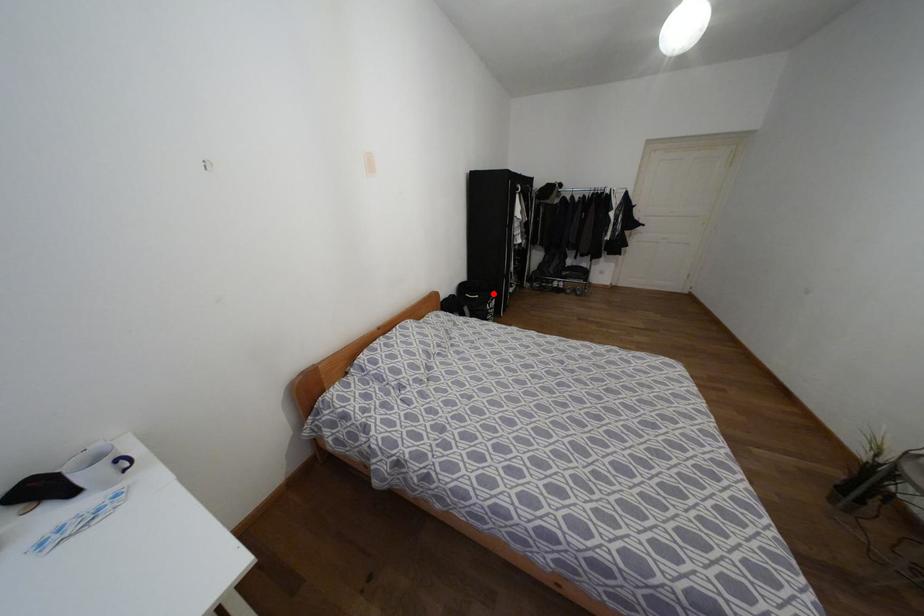
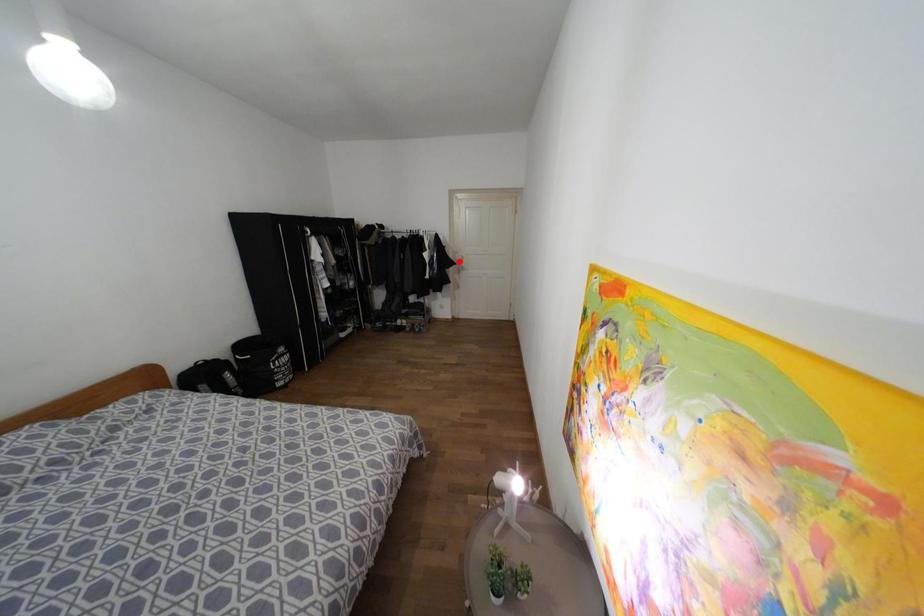
I am providing you with two images of the same scene from different viewpoints. A red point is marked on the first image and another point is marked on the second image. Is the marked point in image1 the same physical position as the marked point in image2?

No